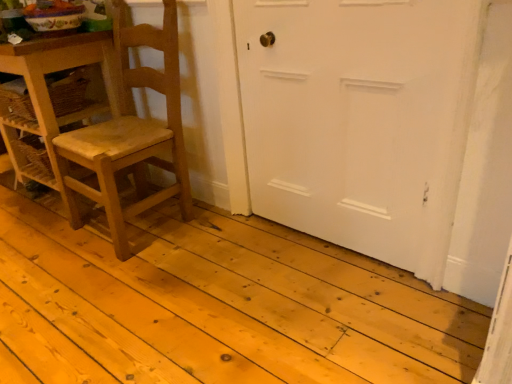
Question: From a real-world perspective, is natural wood floor at center physically located above or below wooden table at left?

Choices:
 (A) above
 (B) below

Answer: (B)

Question: Is point (2, 324) positioned closer to the camera than point (7, 61)?

Choices:
 (A) closer
 (B) farther

Answer: (A)

Question: Estimate the real-world distances between objects in this image. Which object is farther from the wooden table at left?

Choices:
 (A) white matte door at center
 (B) wooden chair at left
 (C) natural wood floor at center

Answer: (A)

Question: Which object is the closest to the natural wood floor at center?

Choices:
 (A) wooden table at left
 (B) white matte door at center
 (C) wooden chair at left

Answer: (C)